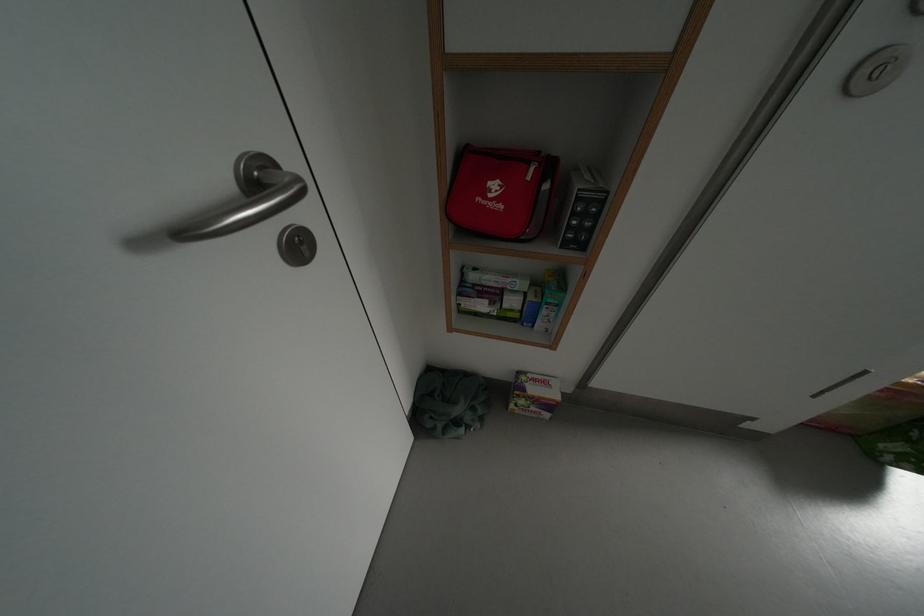
Describe the element at coordinates (296, 245) in the screenshot. I see `the door keyhole` at that location.